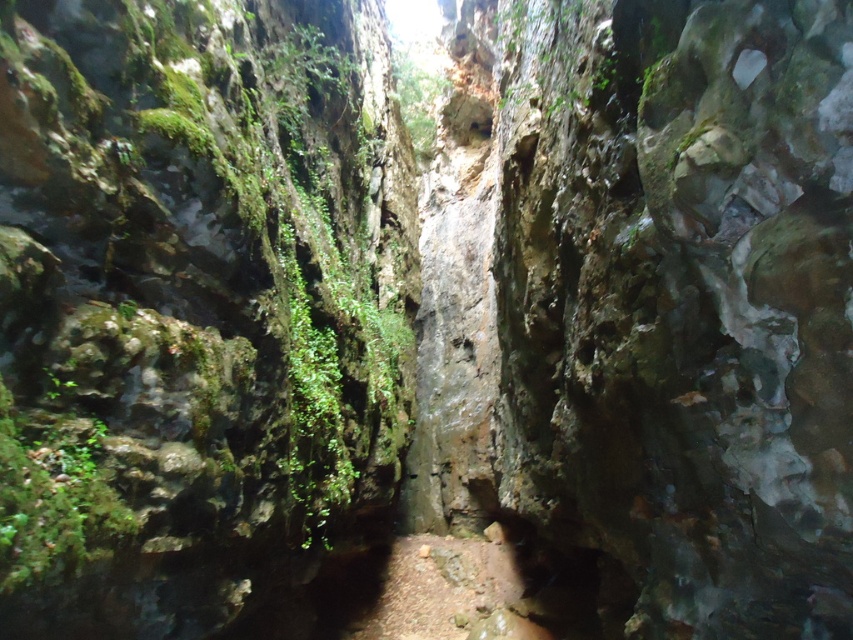
Question: Which of the following is the closest to the observer?

Choices:
 (A) green mossy rock at left
 (B) dirt/granular path at center

Answer: (A)

Question: Is green mossy rock at left smaller than dirt/granular path at center?

Choices:
 (A) yes
 (B) no

Answer: (A)

Question: Which object is farther from the camera taking this photo?

Choices:
 (A) dirt/granular path at center
 (B) green mossy rock at left

Answer: (A)

Question: Which of the following is the closest to the observer?

Choices:
 (A) green mossy rock at left
 (B) dirt/granular path at center

Answer: (A)

Question: Is green mossy rock at left positioned at the back of dirt/granular path at center?

Choices:
 (A) yes
 (B) no

Answer: (B)

Question: Can you confirm if green mossy rock at left is positioned above dirt/granular path at center?

Choices:
 (A) no
 (B) yes

Answer: (B)